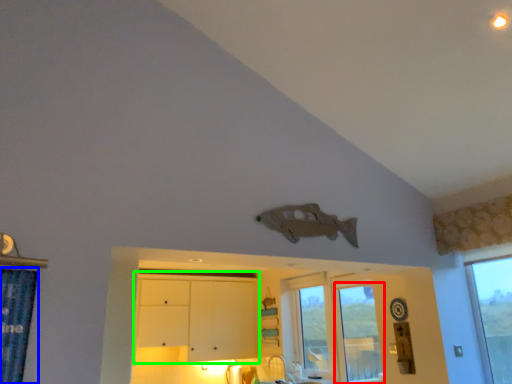
Question: Which object is positioned closest to window (highlighted by a red box)? Select from shower curtain (highlighted by a blue box) and dresser (highlighted by a green box).

Choices:
 (A) shower curtain
 (B) dresser

Answer: (B)